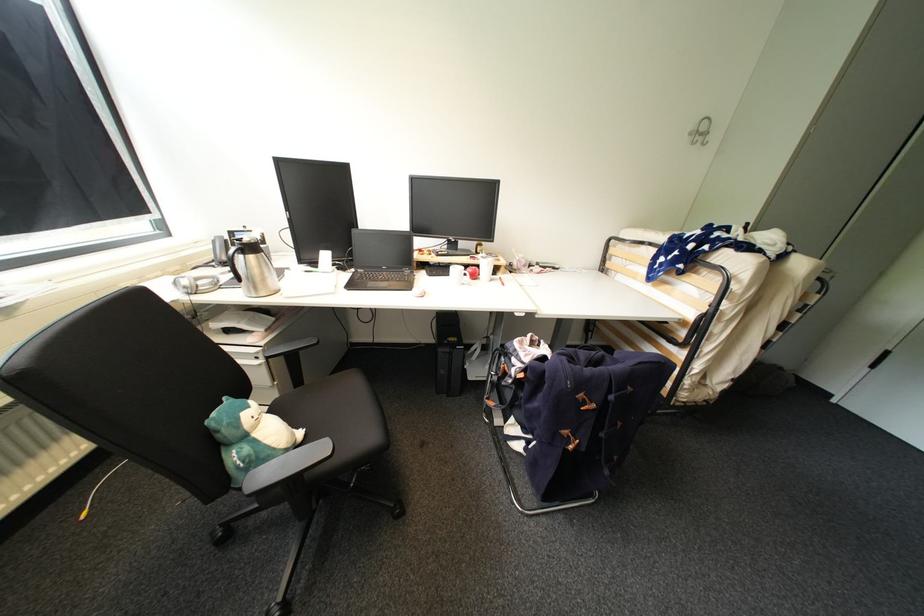
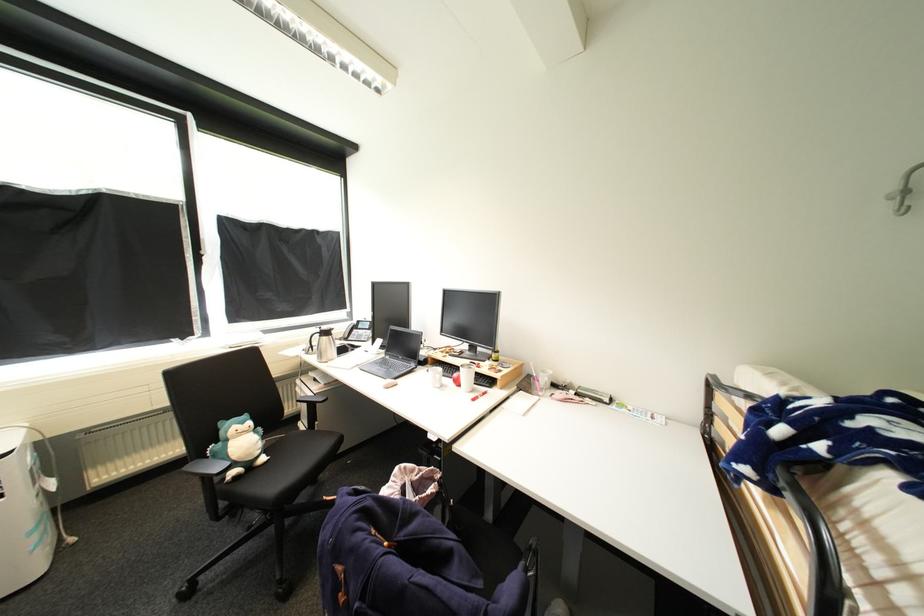
Locate, in the second image, the point that corresponds to point 256,408 in the first image.

(249, 424)